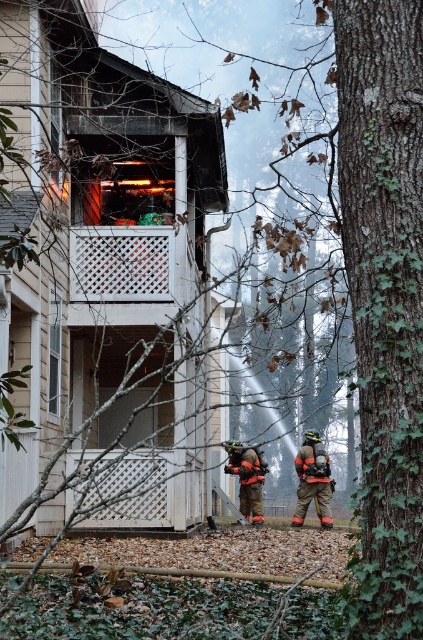
Question: Does orange reflective suit at lower right have a larger size compared to orange reflective gear at lower center?

Choices:
 (A) no
 (B) yes

Answer: (A)

Question: Which object appears farthest from the camera in this image?

Choices:
 (A) orange reflective suit at lower right
 (B) orange reflective gear at lower center

Answer: (B)

Question: Which of the following is the farthest from the observer?

Choices:
 (A) orange reflective gear at lower center
 (B) orange reflective suit at lower right

Answer: (A)

Question: Can you confirm if orange reflective suit at lower right is positioned below orange reflective gear at lower center?

Choices:
 (A) no
 (B) yes

Answer: (B)

Question: In this image, where is orange reflective suit at lower right located relative to orange reflective gear at lower center?

Choices:
 (A) right
 (B) left

Answer: (A)